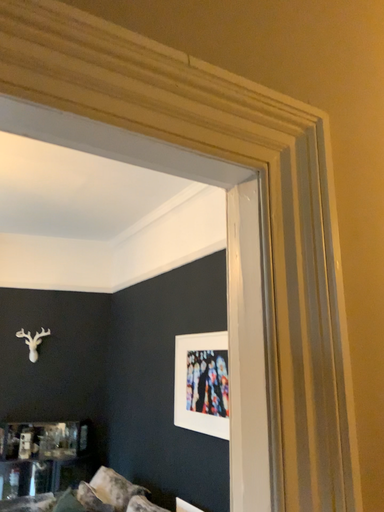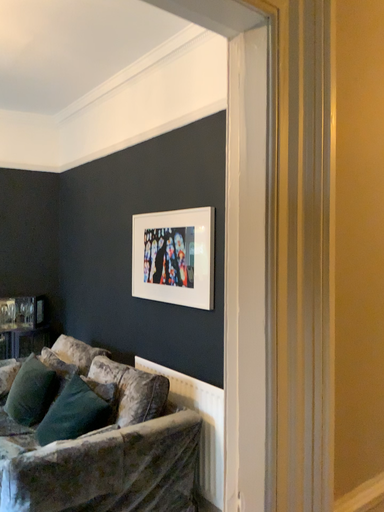
Question: Which way did the camera rotate in the video?

Choices:
 (A) rotated right
 (B) rotated left

Answer: (A)